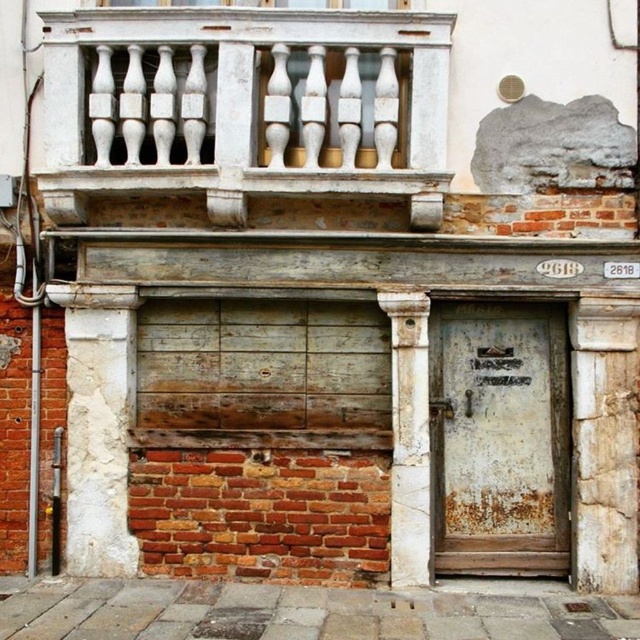
Does white rough stone pillar at left have a greater width compared to rusty metal door at lower right?

No.

Is white rough stone pillar at left above rusty metal door at lower right?

Yes.

Identify the location of white rough stone pillar at left. The width and height of the screenshot is (640, 640). (99, 428).

Is point (54, 120) behind point (392, 348)?

Yes, point (54, 120) is farther from viewer.

Is point (65, 140) positioned in front of point (412, 364)?

No.

The image size is (640, 640). What do you see at coordinates (244, 106) in the screenshot?
I see `white painted wood at upper center` at bounding box center [244, 106].

What are the coordinates of `white painted wood at upper center` in the screenshot? It's located at (244, 106).

Is white painted wood at upper center closer to camera compared to rusty metal door at lower right?

Yes, white painted wood at upper center is in front of rusty metal door at lower right.

Does white painted wood at upper center come behind rusty metal door at lower right?

That is False.

Identify the location of white painted wood at upper center. This screenshot has width=640, height=640. (244, 106).

Image resolution: width=640 pixels, height=640 pixels. I want to click on white painted wood at upper center, so click(244, 106).